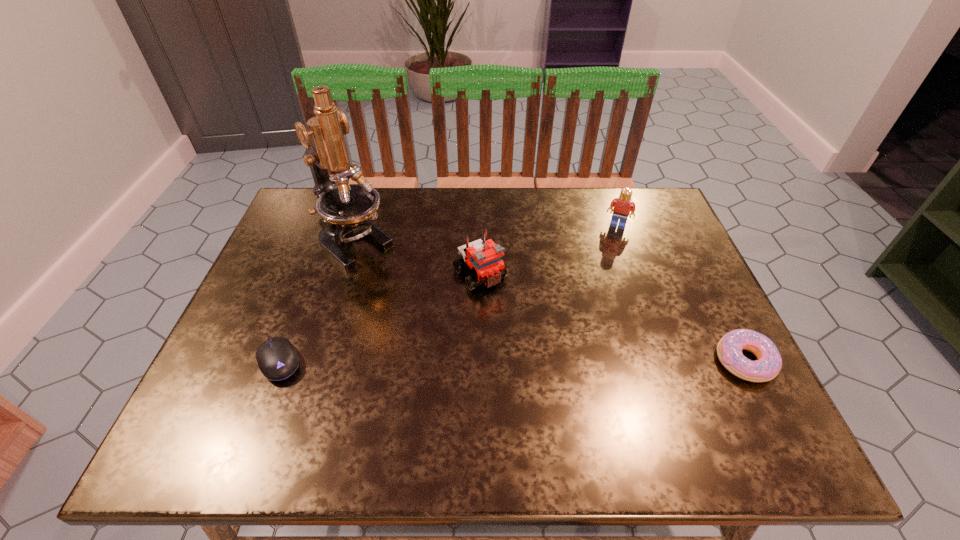
The image size is (960, 540). I want to click on free spot on the desktop that is between the computer mouse and the doughnut and is positioned at the eyepiece of the microscope, so point(492,361).

Locate an element on the screen. This screenshot has height=540, width=960. vacant spot on the desktop that is between the computer mouse and the rightmost object and is positioned on the front-facing side of the nearer Lego is located at coordinates (552, 361).

Where is `vacant space on the desktop that is between the computer mouse and the doughnut and is positioned on the front-facing side of the right Lego`? vacant space on the desktop that is between the computer mouse and the doughnut and is positioned on the front-facing side of the right Lego is located at coordinates (569, 361).